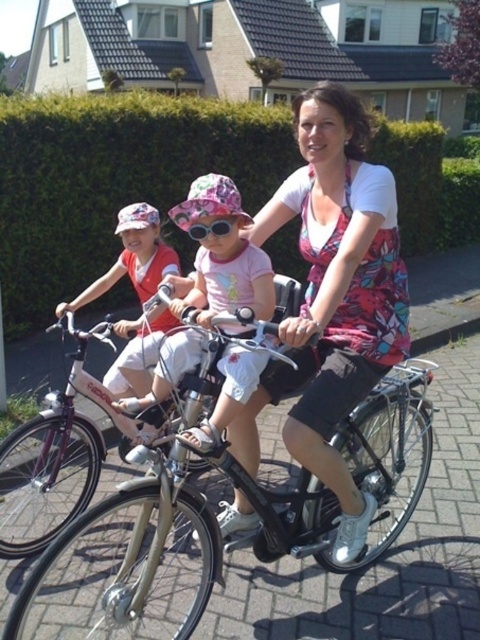
You are a photographer trying to capture a closeup of the floral fabric dress at center and the pink fabric hat at center. Since you want to focus on both, which one should you zoom in on first to ensure the taller object is in frame?

The floral fabric dress at center is much taller than the pink fabric hat at center, so you should zoom in on the floral fabric dress at center first to ensure it fits into the frame.

You are a photographer trying to capture the entire scene in one shot. Given that the green leafy hedge at upper center and the pink fabric hat at upper left are both in your frame, which object would require you to adjust your camera angle less to include fully?

The green leafy hedge at upper center has a smaller width compared to the pink fabric hat at upper left, so you would need to adjust your camera angle less to include the green leafy hedge at upper center fully.

You are a photographer taking a picture of the woman and child riding the black bicycle. You notice the floral fabric dress at center and the pink fabric hat at center. Which one is in front from your perspective?

The floral fabric dress at center is closer to the viewer than the pink fabric hat at center, so the floral fabric dress at center is in front.